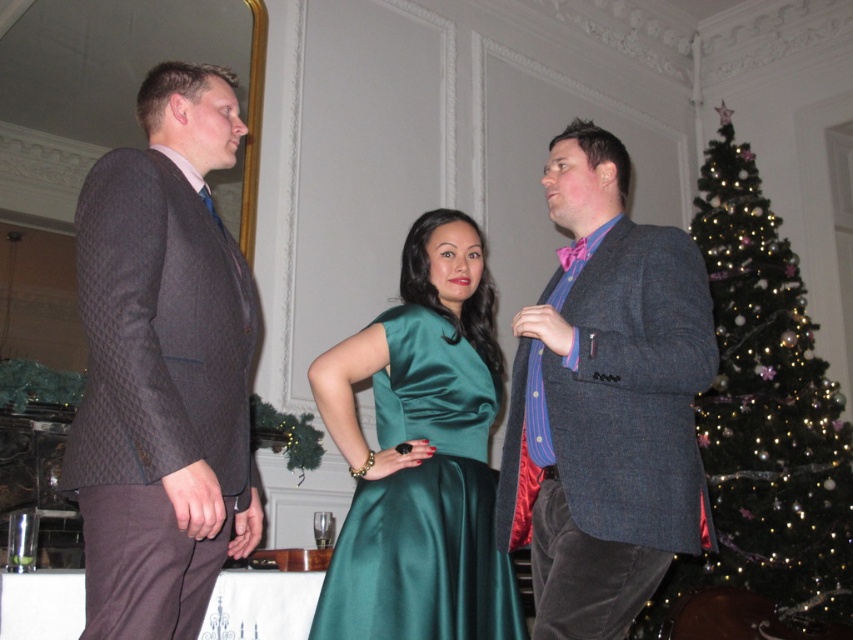
You are standing in the center of the room and want to greet the person in the matte black suit at left. In which direction should you move to approach them?

The matte black suit at left is located at point 0.577 on the x and 0.191 on the y axis. Since you are at the center, you should move towards the left and slightly forward to reach them.

You are planning to take a photo of the matte black suit at left and the shiny green christmas tree at right. Which object should you focus on first if you want to capture both in the same frame without moving the camera?

The matte black suit at left should be focused on first because it is smaller than the shiny green christmas tree at right, allowing it to fit within the frame alongside the larger tree.

You are a photographer setting up for a group photo. You notice two items in the scene that might be important for the composition. The textured gray blazer at center and the satin green dress at center. Which of these items is taller?

The textured gray blazer at center is taller than the satin green dress at center according to the description.